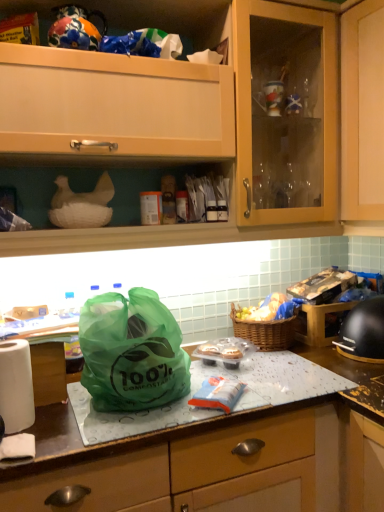
Image resolution: width=384 pixels, height=512 pixels. I want to click on free point in front of woven brown picnic basket at center, so click(306, 362).